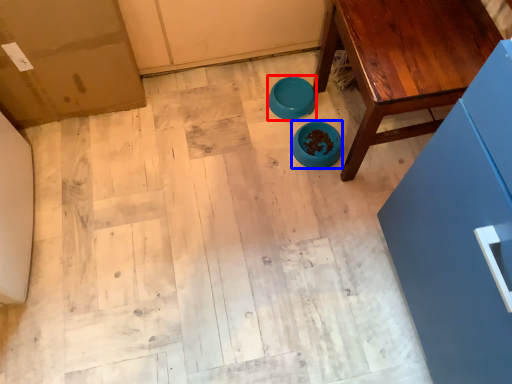
Question: Which object is further to the camera taking this photo, bowl (highlighted by a red box) or bowl (highlighted by a blue box)?

Choices:
 (A) bowl
 (B) bowl

Answer: (A)